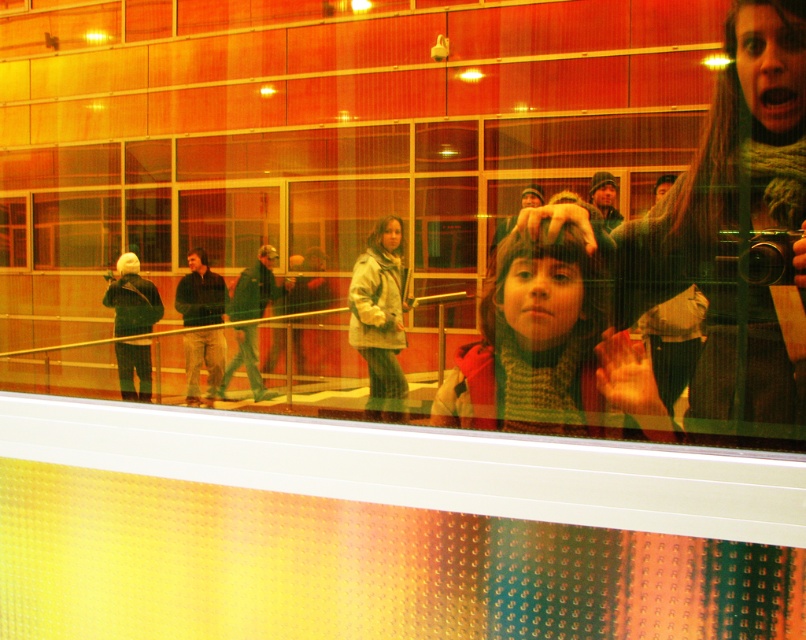
Question: Among these points, which one is nearest to the camera?

Choices:
 (A) (777, 321)
 (B) (522, 381)
 (C) (364, 253)

Answer: (B)

Question: Does knitted scarf at center appear on the left side of matte gray coat at center?

Choices:
 (A) yes
 (B) no

Answer: (B)

Question: Considering the real-world distances, which object is farthest from the knitted scarf at center?

Choices:
 (A) knitted scarf at right
 (B) matte gray coat at center

Answer: (B)

Question: From the image, what is the correct spatial relationship of knitted scarf at right in relation to matte gray coat at center?

Choices:
 (A) above
 (B) below

Answer: (A)

Question: Estimate the real-world distances between objects in this image. Which object is closer to the matte gray coat at center?

Choices:
 (A) knitted scarf at center
 (B) knitted scarf at right

Answer: (A)

Question: Does knitted scarf at center lie in front of matte gray coat at center?

Choices:
 (A) no
 (B) yes

Answer: (B)